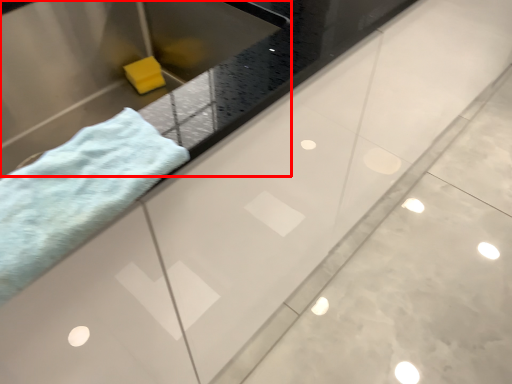
Question: From the image's perspective, where is sink (annotated by the red box) located relative to towel?

Choices:
 (A) below
 (B) above

Answer: (B)